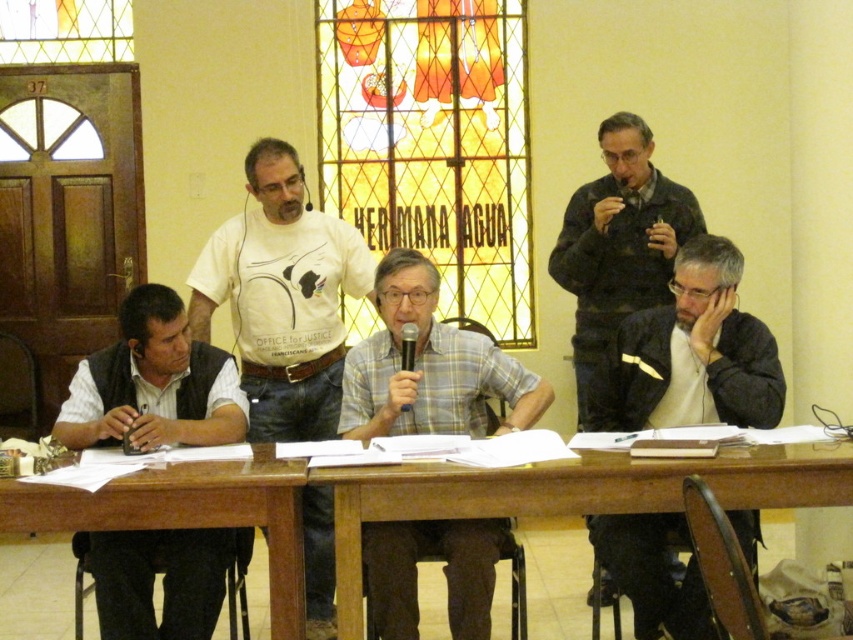
Can you confirm if white shirt at left is positioned to the left of plaid fabric shirt at center?

Indeed, white shirt at left is positioned on the left side of plaid fabric shirt at center.

Between point (193, 596) and point (454, 552), which one is positioned behind?

The point (193, 596) is more distant.

Locate an element on the screen. This screenshot has height=640, width=853. white shirt at left is located at coordinates (154, 384).

Which is more to the right, white t-shirt at center or wooden table at center?

→ wooden table at center is more to the right.

Can you confirm if white t-shirt at center is positioned to the left of wooden table at center?

Correct, you'll find white t-shirt at center to the left of wooden table at center.

Does point (294, 388) come behind point (793, 484)?

Yes, point (294, 388) is farther from viewer.

The width and height of the screenshot is (853, 640). I want to click on white t-shirt at center, so click(282, 298).

Does white t-shirt at center appear on the left side of dark gray jacket at right?

Correct, you'll find white t-shirt at center to the left of dark gray jacket at right.

Which is in front, point (314, 412) or point (695, 401)?

Point (695, 401) is more forward.

Between point (317, 499) and point (683, 534), which one is positioned in front?

Point (683, 534) is in front.

I want to click on white t-shirt at center, so click(x=282, y=298).